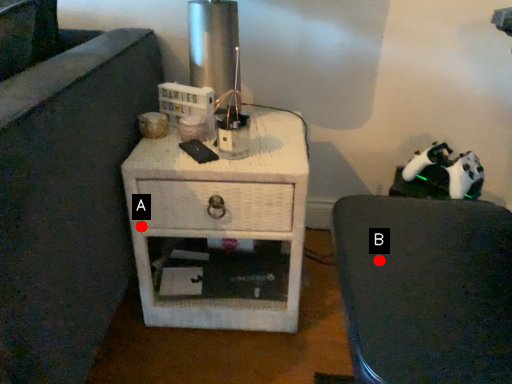
Question: Two points are circled on the image, labeled by A and B beside each circle. Which point is closer to the camera?

Choices:
 (A) A is closer
 (B) B is closer

Answer: (B)